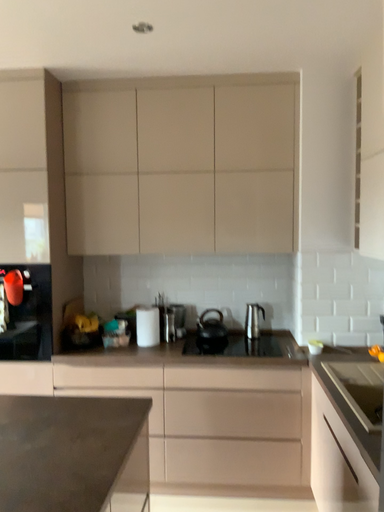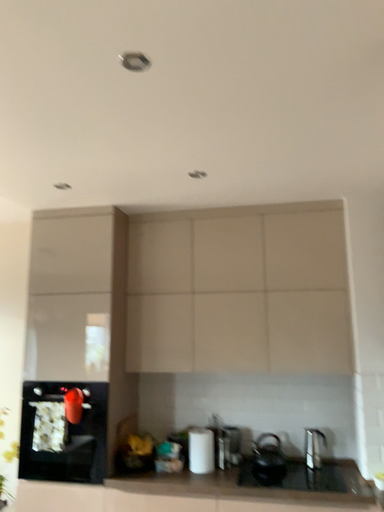
Question: How did the camera likely rotate when shooting the video?

Choices:
 (A) rotated left
 (B) rotated right

Answer: (A)